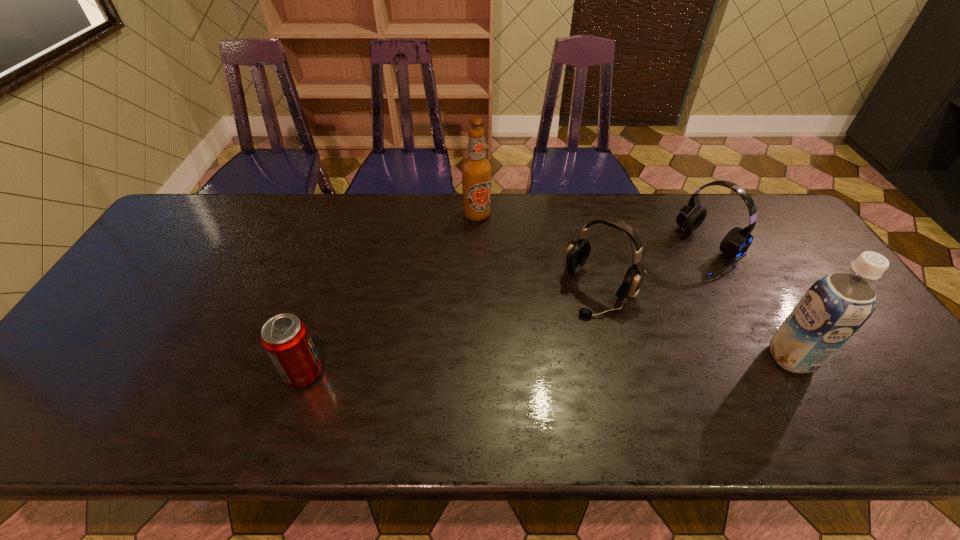
Point out which object is positioned as the second nearest to the left headset. Please provide its 2D coordinates. Your answer should be formatted as a tuple, i.e. [(x, y)], where the tuple contains the x and y coordinates of a point satisfying the conditions above.

[(476, 170)]

Select which object appears as the second closest to the shortest object. Please provide its 2D coordinates. Your answer should be formatted as a tuple, i.e. [(x, y)], where the tuple contains the x and y coordinates of a point satisfying the conditions above.

[(577, 253)]

This screenshot has width=960, height=540. Identify the location of blank area in the image that satisfies the following two spatial constraints: 1. on the back side of the soda can; 2. on the left side of the third object from left to right. coord(330,290).

Where is `vacant space that satisfies the following two spatial constraints: 1. on the back side of the soya milk; 2. on the label of the soda can`? The image size is (960, 540). vacant space that satisfies the following two spatial constraints: 1. on the back side of the soya milk; 2. on the label of the soda can is located at coordinates (308, 357).

The image size is (960, 540). Find the location of `vacant region that satisfies the following two spatial constraints: 1. on the front side of the right headset; 2. on the label of the soya milk`. vacant region that satisfies the following two spatial constraints: 1. on the front side of the right headset; 2. on the label of the soya milk is located at coordinates (769, 357).